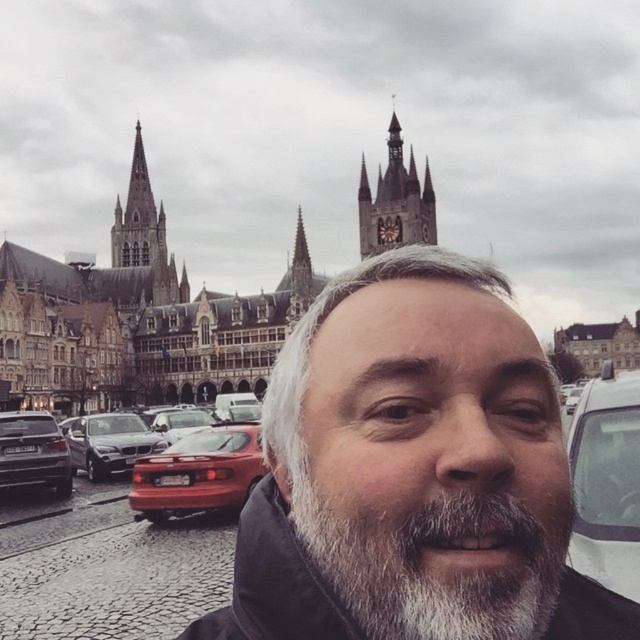
Question: Which point is farther to the camera?

Choices:
 (A) golden stone clock tower at upper center
 (B) shiny red car at center
 (C) white glossy car at lower right

Answer: (A)

Question: Which point is closer to the camera?

Choices:
 (A) pos(384,600)
 (B) pos(115,452)

Answer: (A)

Question: Considering the relative positions of white glossy car at lower right and shiny red car at center in the image provided, where is white glossy car at lower right located with respect to shiny red car at center?

Choices:
 (A) below
 (B) above

Answer: (B)

Question: In this image, where is shiny silver sedan at left located relative to satin silver car at center?

Choices:
 (A) above
 (B) below

Answer: (A)

Question: Which point is farther to the camera?

Choices:
 (A) golden stone clock tower at upper center
 (B) satin silver car at center
 (C) gray hair at center

Answer: (A)

Question: Can you confirm if shiny silver sedan at left is positioned to the left of satin silver car at center?

Choices:
 (A) yes
 (B) no

Answer: (A)